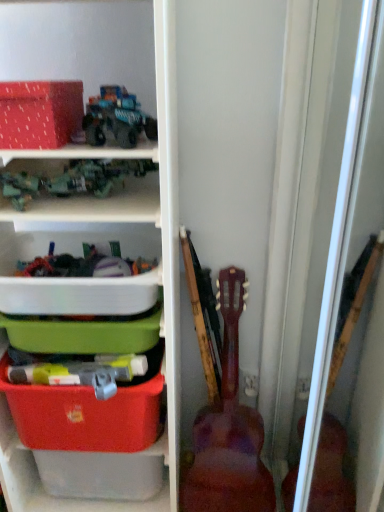
Where is `matte plastic storage box at lower left, acting as the 3th storage box starting from the top`? The width and height of the screenshot is (384, 512). matte plastic storage box at lower left, acting as the 3th storage box starting from the top is located at coordinates (84, 415).

Locate an element on the screen. Image resolution: width=384 pixels, height=512 pixels. matte red storage box at upper left, the 3th storage box positioned from the bottom is located at coordinates (39, 113).

What do you see at coordinates (119, 279) in the screenshot? This screenshot has height=512, width=384. I see `matte plastic storage bin at left` at bounding box center [119, 279].

Image resolution: width=384 pixels, height=512 pixels. Describe the element at coordinates (228, 428) in the screenshot. I see `wooden acoustic guitar at right` at that location.

Where is `matte plastic storage box at lower left, acting as the 3th storage box starting from the top`? This screenshot has width=384, height=512. matte plastic storage box at lower left, acting as the 3th storage box starting from the top is located at coordinates (84, 415).

Identify the location of storage box to the left of matte plastic storage box at lower left, which is the first storage box in bottom-to-top order. (39, 113).

Who is bigger, matte plastic storage box at lower left, acting as the 3th storage box starting from the top, or matte red storage box at upper left, the first storage box in the top-to-bottom sequence?

With larger size is matte plastic storage box at lower left, acting as the 3th storage box starting from the top.

From the picture: Which is more to the right, matte plastic storage box at lower left, which is the first storage box in bottom-to-top order, or matte red storage box at upper left, the first storage box in the top-to-bottom sequence?

From the viewer's perspective, matte plastic storage box at lower left, which is the first storage box in bottom-to-top order, appears more on the right side.

From a real-world perspective, is matte plastic storage box at lower left, which is the first storage box in bottom-to-top order, on top of matte red storage box at upper left, the first storage box in the top-to-bottom sequence?

No.

Does point (96, 309) come behind point (129, 108)?

Yes, it is behind point (129, 108).

From a real-world perspective, between white plastic container at center, the second storage box from the top, and teal matte truck at upper center, acting as the 2th toy starting from the bottom, who is vertically higher?

From a 3D spatial view, teal matte truck at upper center, acting as the 2th toy starting from the bottom, is above.

Is white plastic container at center, the second storage box from the top, bigger than teal matte truck at upper center, which is the first toy from top to bottom?

Yes, white plastic container at center, the second storage box from the top, is bigger than teal matte truck at upper center, which is the first toy from top to bottom.

From the image's perspective, starting from the teal matte truck at upper center, acting as the 2th toy starting from the bottom, which storage box is the 1st one below? Please provide its 2D coordinates.

[(79, 295)]

Is metallic green toy truck at upper left, the first toy when ordered from left to right, taller than teal matte truck at upper center, which is the first toy from top to bottom?

No.

Does metallic green toy truck at upper left, which ranks as the second toy in top-to-bottom order, have a larger size compared to teal matte truck at upper center, acting as the 2th toy starting from the bottom?

No, metallic green toy truck at upper left, which ranks as the second toy in top-to-bottom order, is not bigger than teal matte truck at upper center, acting as the 2th toy starting from the bottom.

Looking at their sizes, would you say metallic green toy truck at upper left, the first toy when ordered from left to right, is wider or thinner than teal matte truck at upper center, which is the first toy from top to bottom?

metallic green toy truck at upper left, the first toy when ordered from left to right, is wider than teal matte truck at upper center, which is the first toy from top to bottom.

In the scene shown: Is metallic green toy truck at upper left, which ranks as the 2th toy in right-to-left order, turned away from teal matte truck at upper center, acting as the 2th toy starting from the bottom?

metallic green toy truck at upper left, which ranks as the 2th toy in right-to-left order, is not turned away from teal matte truck at upper center, acting as the 2th toy starting from the bottom.

Which is closer, (245, 473) or (123, 100)?

Point (245, 473).

Is wooden acoustic guitar at right shorter than teal matte truck at upper center, the second toy in the left-to-right sequence?

No, wooden acoustic guitar at right is not shorter than teal matte truck at upper center, the second toy in the left-to-right sequence.

Is wooden acoustic guitar at right beside teal matte truck at upper center, which is the first toy from top to bottom?

wooden acoustic guitar at right and teal matte truck at upper center, which is the first toy from top to bottom, are clearly separated.

Which object is wider, wooden acoustic guitar at right or teal matte truck at upper center, which is counted as the 1th toy, starting from the right?

wooden acoustic guitar at right is wider.

Is matte red storage box at upper left, the first storage box in the top-to-bottom sequence, looking in the opposite direction of teal matte truck at upper center, which is counted as the 1th toy, starting from the right?

No, matte red storage box at upper left, the first storage box in the top-to-bottom sequence, is not facing the opposite direction of teal matte truck at upper center, which is counted as the 1th toy, starting from the right.

Is matte red storage box at upper left, the 3th storage box positioned from the bottom, directly adjacent to teal matte truck at upper center, acting as the 2th toy starting from the bottom?

Yes, matte red storage box at upper left, the 3th storage box positioned from the bottom, is beside teal matte truck at upper center, acting as the 2th toy starting from the bottom.

From the image's perspective, is matte red storage box at upper left, the 3th storage box positioned from the bottom, over teal matte truck at upper center, the second toy in the left-to-right sequence?

Yes, from the image's perspective, matte red storage box at upper left, the 3th storage box positioned from the bottom, is above teal matte truck at upper center, the second toy in the left-to-right sequence.

What's the angular difference between matte red storage box at upper left, the first storage box in the top-to-bottom sequence, and teal matte truck at upper center, the second toy in the left-to-right sequence,'s facing directions?

The angle between the facing direction of matte red storage box at upper left, the first storage box in the top-to-bottom sequence, and the facing direction of teal matte truck at upper center, the second toy in the left-to-right sequence, is 6.64 degrees.

Who is bigger, matte plastic storage box at lower left, which is the first storage box in bottom-to-top order, or white plastic container at center, which is the second storage box in bottom-to-top order?

With larger size is white plastic container at center, which is the second storage box in bottom-to-top order.

Considering the positions of objects matte plastic storage box at lower left, which is the first storage box in bottom-to-top order, and white plastic container at center, the second storage box from the top, in the image provided, who is more to the left, matte plastic storage box at lower left, which is the first storage box in bottom-to-top order, or white plastic container at center, the second storage box from the top,?

Positioned to the left is matte plastic storage box at lower left, which is the first storage box in bottom-to-top order.

Is point (147, 436) in front of point (60, 298)?

No, (147, 436) is behind (60, 298).

From the image's perspective, who appears lower, matte plastic storage box at lower left, which is the first storage box in bottom-to-top order, or white plastic container at center, which is the second storage box in bottom-to-top order?

matte plastic storage box at lower left, which is the first storage box in bottom-to-top order.

Which object is more forward, wooden acoustic guitar at right or matte plastic storage bin at left?

matte plastic storage bin at left is more forward.

From a real-world perspective, is wooden acoustic guitar at right on top of matte plastic storage bin at left?

Actually, wooden acoustic guitar at right is physically below matte plastic storage bin at left in the real world.

Is matte plastic storage bin at left inside wooden acoustic guitar at right?

No, wooden acoustic guitar at right does not contain matte plastic storage bin at left.

Measure the distance from wooden acoustic guitar at right to matte plastic storage bin at left.

11.30 inches.

Starting from the matte red storage box at upper left, the first storage box in the top-to-bottom sequence, which storage box is the 2nd one behind? Please provide its 2D coordinates.

[(84, 415)]

Starting from the white plastic container at center, the second storage box from the top, which toy is the 2nd one in front? Please provide its 2D coordinates.

[(116, 118)]

Considering their positions, is matte red storage box at upper left, the 3th storage box positioned from the bottom, positioned closer to wooden acoustic guitar at right than metallic green toy truck at upper left, the first toy when ordered from left to right?

metallic green toy truck at upper left, the first toy when ordered from left to right, lies closer to wooden acoustic guitar at right than the other object.

From the image, which object appears to be farther from wooden acoustic guitar at right, teal matte truck at upper center, acting as the 2th toy starting from the bottom, or white plastic container at center, the second storage box from the top?

Based on the image, teal matte truck at upper center, acting as the 2th toy starting from the bottom, appears to be further to wooden acoustic guitar at right.

From the image, which object appears to be nearer to matte red storage box at upper left, the 3th storage box positioned from the bottom, white plastic container at center, the second storage box from the top, or wooden acoustic guitar at right?

white plastic container at center, the second storage box from the top, is closer to matte red storage box at upper left, the 3th storage box positioned from the bottom.

When comparing their distances from metallic green toy truck at upper left, which ranks as the second toy in top-to-bottom order, does wooden acoustic guitar at right or teal matte truck at upper center, acting as the 2th toy starting from the bottom, seem closer?

teal matte truck at upper center, acting as the 2th toy starting from the bottom.

Based on their spatial positions, is metallic green toy truck at upper left, the first toy when ordered from left to right, or matte plastic storage bin at left further from matte red storage box at upper left, the first storage box in the top-to-bottom sequence?

matte plastic storage bin at left lies further to matte red storage box at upper left, the first storage box in the top-to-bottom sequence, than the other object.

Based on their spatial positions, is white plastic container at center, which is the second storage box in bottom-to-top order, or teal matte truck at upper center, which is the first toy from top to bottom, further from metallic green toy truck at upper left, acting as the 1th toy starting from the bottom?

white plastic container at center, which is the second storage box in bottom-to-top order, is further to metallic green toy truck at upper left, acting as the 1th toy starting from the bottom.

Which object lies nearer to the anchor point wooden acoustic guitar at right, matte plastic storage box at lower left, acting as the 3th storage box starting from the top, or metallic green toy truck at upper left, which ranks as the second toy in top-to-bottom order?

matte plastic storage box at lower left, acting as the 3th storage box starting from the top.

When comparing their distances from wooden acoustic guitar at right, does matte red storage box at upper left, the 3th storage box positioned from the bottom, or matte plastic storage bin at left seem further?

matte red storage box at upper left, the 3th storage box positioned from the bottom, lies further to wooden acoustic guitar at right than the other object.

Locate an element on the screen. The height and width of the screenshot is (512, 384). shelf between white plastic container at center, which is the second storage box in bottom-to-top order, and matte plastic storage box at lower left, which is the first storage box in bottom-to-top order, from top to bottom is located at coordinates (119, 279).

Where is `shelf between white plastic container at center, the second storage box from the top, and wooden acoustic guitar at right from left to right`? This screenshot has width=384, height=512. shelf between white plastic container at center, the second storage box from the top, and wooden acoustic guitar at right from left to right is located at coordinates (119, 279).

You are a GUI agent. You are given a task and a screenshot of the screen. Output one action in this format:
    pyautogui.click(x=<x>, y=<y>)
    Task: Click on the storage box that lies between metallic green toy truck at upper left, acting as the 1th toy starting from the bottom, and matte plastic storage box at lower left, which is the first storage box in bottom-to-top order, from top to bottom
    The height and width of the screenshot is (512, 384).
    Given the screenshot: What is the action you would take?
    pyautogui.click(x=79, y=295)

What are the coordinates of `toy between teal matte truck at upper center, acting as the 2th toy starting from the bottom, and wooden acoustic guitar at right from top to bottom` in the screenshot? It's located at (73, 180).